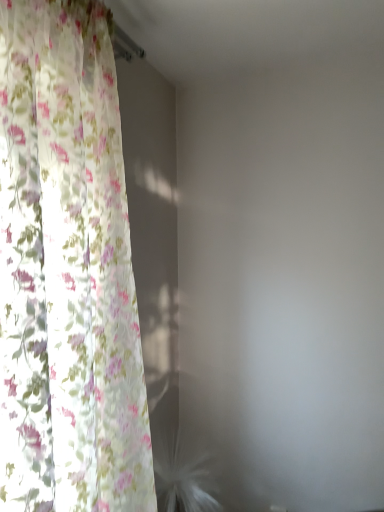
What is the approximate width of matte floral curtain at center?

9.42 inches.

This screenshot has width=384, height=512. Describe the element at coordinates (67, 271) in the screenshot. I see `matte floral curtain at center` at that location.

Find the location of `matte floral curtain at center`. matte floral curtain at center is located at coordinates (67, 271).

I want to click on matte floral curtain at center, so click(x=67, y=271).